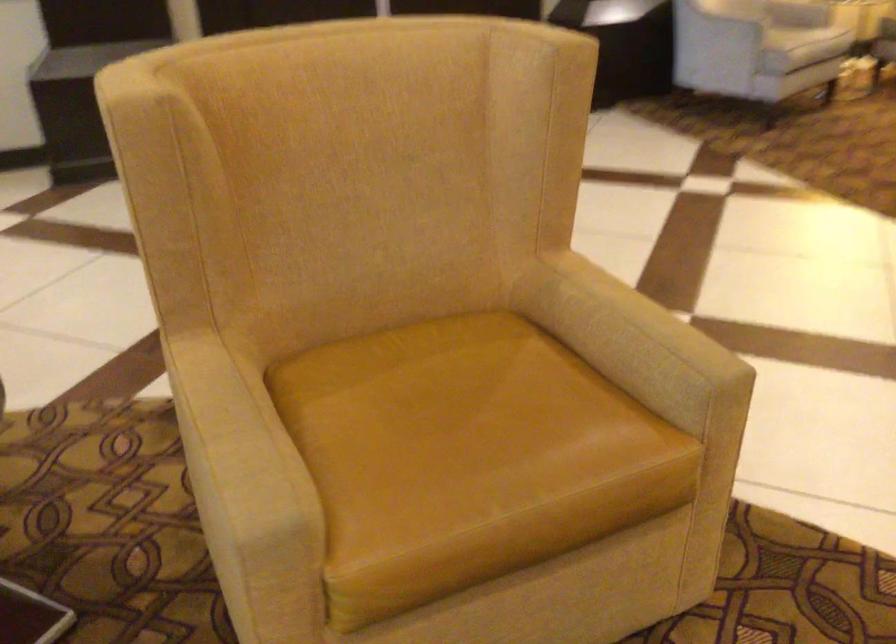
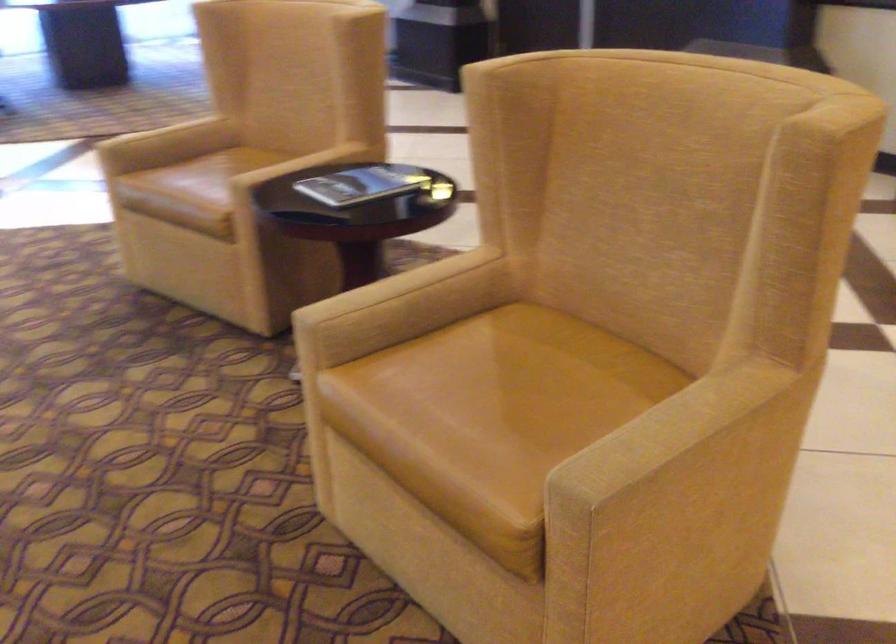
The point at (209, 437) is marked in the first image. Where is the corresponding point in the second image?

(394, 286)